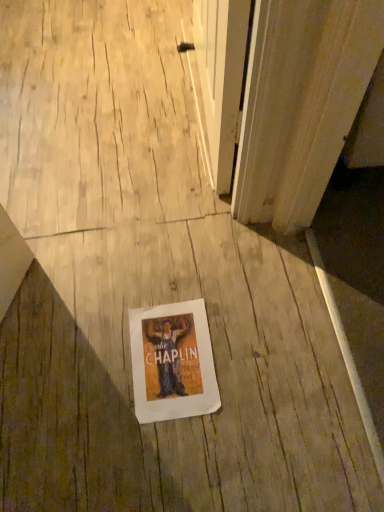
In order to face white paper postcard at center, should I rotate leftwards or rightwards?

It's best to rotate left around 2.640 degrees.

I want to click on white paper postcard at center, so click(172, 362).

Describe the element at coordinates (172, 362) in the screenshot. I see `white paper postcard at center` at that location.

Where is `white paper postcard at center`? This screenshot has width=384, height=512. white paper postcard at center is located at coordinates (172, 362).